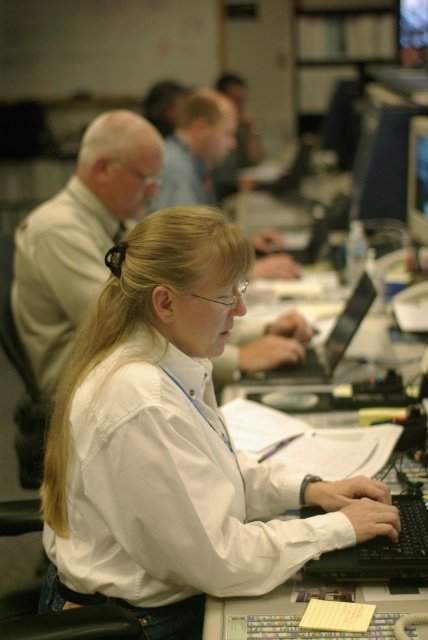
Is black plastic laptop at center wider than matte black monitor at upper right?

Indeed, black plastic laptop at center has a greater width compared to matte black monitor at upper right.

Can you confirm if black plastic laptop at center is thinner than matte black monitor at upper right?

No, black plastic laptop at center is not thinner than matte black monitor at upper right.

Which is behind, point (338, 323) or point (421, 177)?

Point (421, 177)

Identify the location of black plastic laptop at center. The image size is (428, 640). (329, 340).

Is white plastic table at center shorter than matte black monitor at upper right?

Correct, white plastic table at center is not as tall as matte black monitor at upper right.

Is white plastic table at center above matte black monitor at upper right?

No.

Find the location of `white plastic table at center`. white plastic table at center is located at coordinates (306, 442).

Who is more distant from viewer, (398, 433) or (368, 289)?

Positioned behind is point (368, 289).

Can you confirm if white plastic table at center is wider than black plastic laptop at center?

Yes.

You are a GUI agent. You are given a task and a screenshot of the screen. Output one action in this format:
    pyautogui.click(x=<x>, y=<y>)
    Task: Click on the white plastic table at center
    
    Given the screenshot: What is the action you would take?
    pyautogui.click(x=306, y=442)

I want to click on white plastic table at center, so click(x=306, y=442).